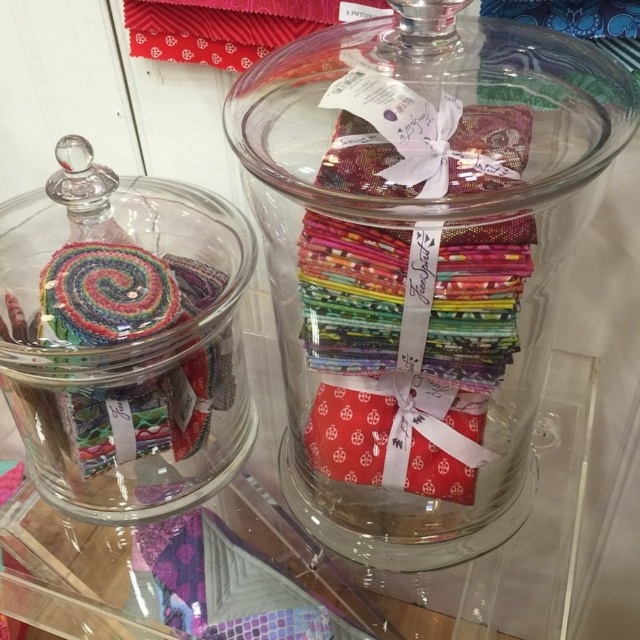
Is transparent glass jar at center bigger than multicolored fabric at left?

Yes, transparent glass jar at center is bigger than multicolored fabric at left.

Which of these two, transparent glass jar at center or multicolored fabric at left, stands shorter?

multicolored fabric at left is shorter.

What do you see at coordinates (422, 262) in the screenshot? The width and height of the screenshot is (640, 640). I see `transparent glass jar at center` at bounding box center [422, 262].

At what (x,y) coordinates should I click in order to perform the action: click on transparent glass jar at center. Please return your answer as a coordinate pair (x, y). Looking at the image, I should click on (422, 262).